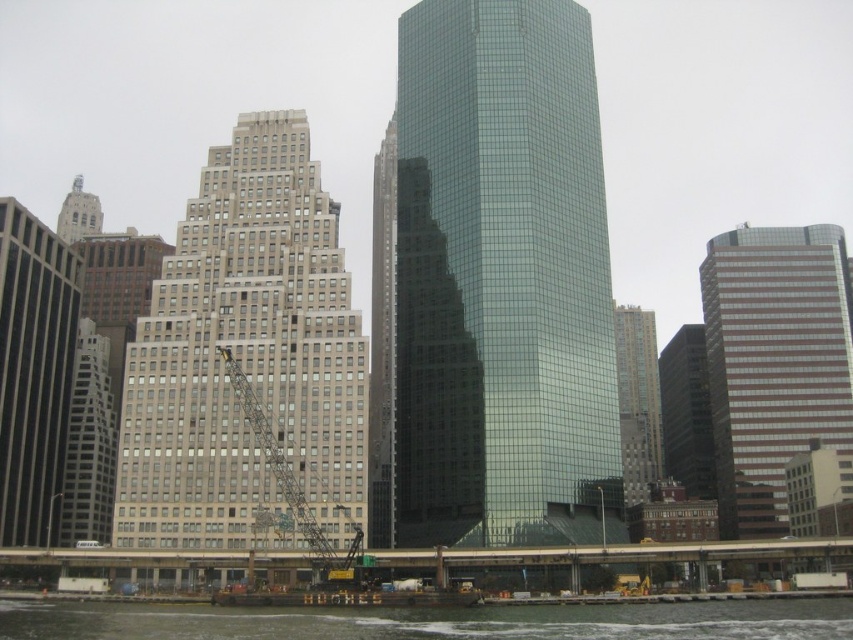
Can you confirm if clear water at lower center is bigger than gray concrete building at left?

Indeed, clear water at lower center has a larger size compared to gray concrete building at left.

Between clear water at lower center and gray concrete building at left, which one has less height?

clear water at lower center

Is point (12, 604) more distant than point (96, 401)?

No, it is not.

Find the location of a particular element. The width and height of the screenshot is (853, 640). clear water at lower center is located at coordinates (434, 621).

Can you confirm if gray stone building at center is shorter than silver metallic spire at upper left?

No, gray stone building at center is not shorter than silver metallic spire at upper left.

Is gray stone building at center positioned behind silver metallic spire at upper left?

No.

Is point (140, 358) closer to camera compared to point (91, 216)?

Yes, it is in front of point (91, 216).

This screenshot has height=640, width=853. I want to click on gray stone building at center, so click(247, 362).

Does dark gray concrete skyscraper at left have a greater height compared to gray concrete building at left?

Yes, dark gray concrete skyscraper at left is taller than gray concrete building at left.

Does dark gray concrete skyscraper at left appear over gray concrete building at left?

Yes, dark gray concrete skyscraper at left is above gray concrete building at left.

What do you see at coordinates (33, 371) in the screenshot?
I see `dark gray concrete skyscraper at left` at bounding box center [33, 371].

This screenshot has height=640, width=853. In order to click on dark gray concrete skyscraper at left in this screenshot , I will do `click(33, 371)`.